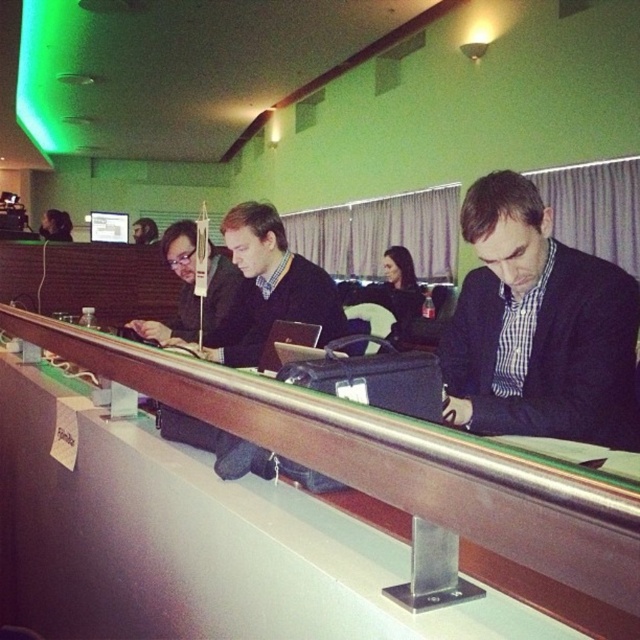
Question: Which object is the farthest from the wooden table at center?

Choices:
 (A) black matte suit at center
 (B) black fabric jacket at center

Answer: (B)

Question: Considering the real-world distances, which object is closest to the black matte suit at center?

Choices:
 (A) wooden table at center
 (B) black fabric jacket at center

Answer: (A)

Question: Does black matte suit at center appear under wooden table at center?

Choices:
 (A) no
 (B) yes

Answer: (A)

Question: Which point is closer to the camera?

Choices:
 (A) wooden table at center
 (B) black fabric jacket at center
 (C) black matte suit at center

Answer: (A)

Question: Can you confirm if wooden table at center is smaller than black fabric jacket at center?

Choices:
 (A) no
 (B) yes

Answer: (B)

Question: Does black matte suit at center appear on the right side of black fabric jacket at center?

Choices:
 (A) yes
 (B) no

Answer: (B)